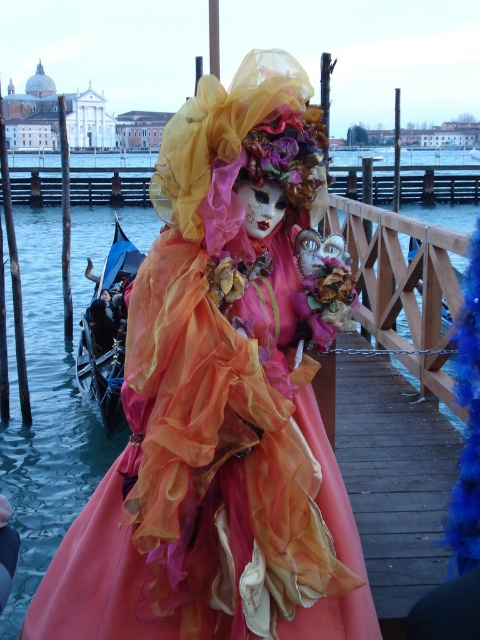
Which of these two, matte orange fabric doll at center or black wood boat at left, stands shorter?

With less height is matte orange fabric doll at center.

Is point (268, 182) more distant than point (96, 275)?

No, (268, 182) is in front of (96, 275).

Does point (262, 358) lie behind point (97, 301)?

No, (262, 358) is closer to viewer.

At what (x,y) coordinates should I click in order to perform the action: click on matte orange fabric doll at center. Please return your answer as a coordinate pair (x, y). This screenshot has width=480, height=640. Looking at the image, I should click on click(x=218, y=406).